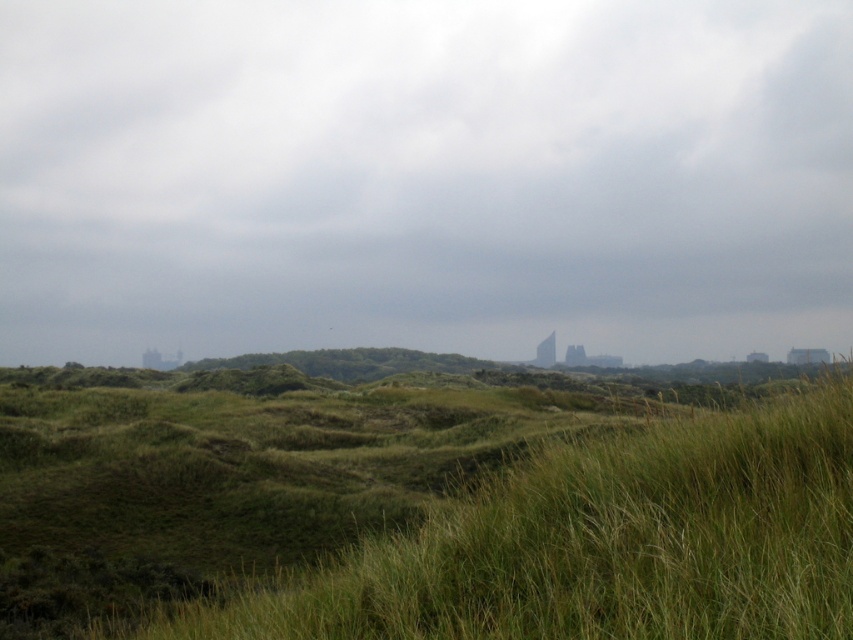
Is gray cloudy sky at upper center shorter than green grassy at center?

No, gray cloudy sky at upper center is not shorter than green grassy at center.

The height and width of the screenshot is (640, 853). I want to click on gray cloudy sky at upper center, so click(x=424, y=177).

Who is more forward, (791, 246) or (253, 627)?

Point (253, 627)

Locate an element on the screen. This screenshot has height=640, width=853. gray cloudy sky at upper center is located at coordinates (424, 177).